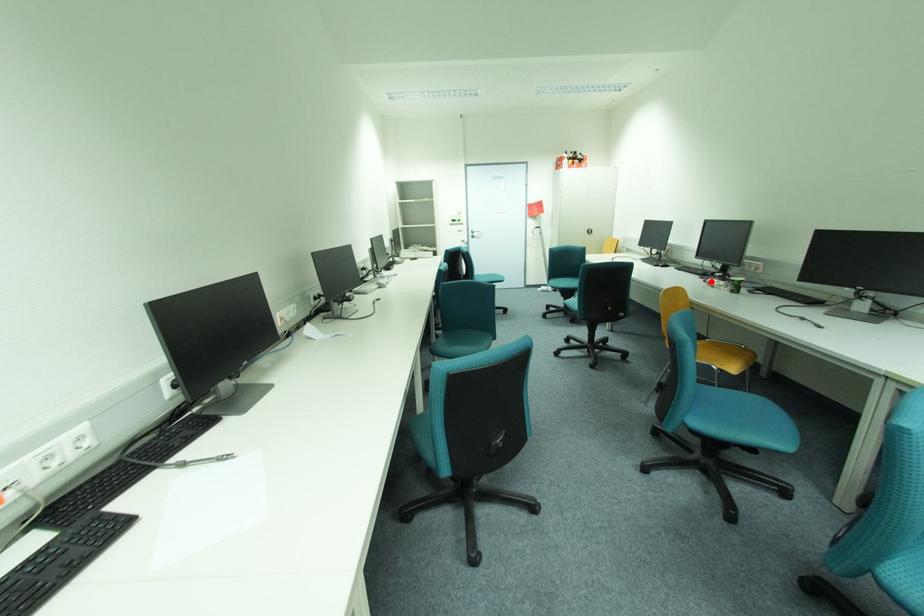
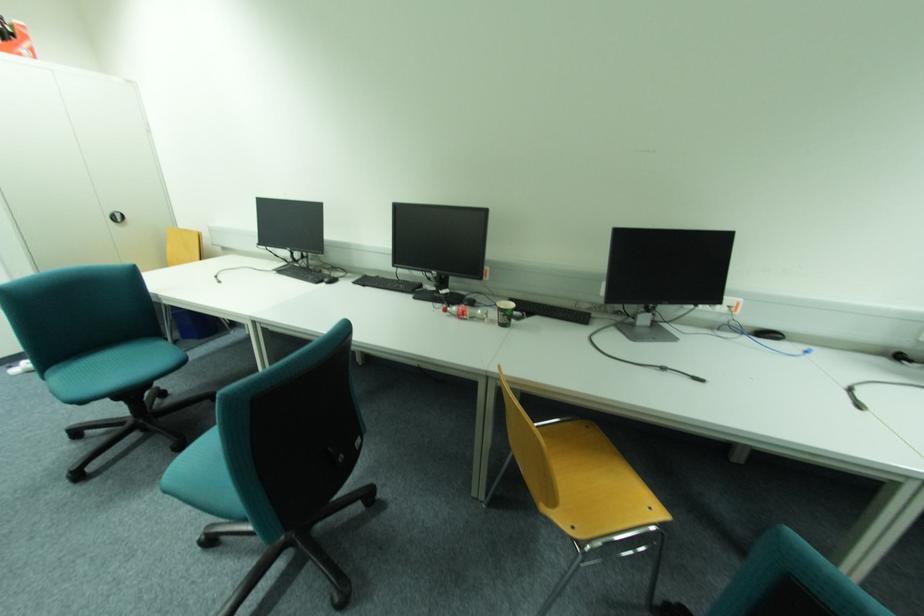
Question: A red point is marked in image1. In image2, is the corresponding 3D point closer to the camera or farther? Reply with the corresponding letter.

Choices:
 (A) The corresponding 3D point is closer.
 (B) The corresponding 3D point is farther.

Answer: (B)